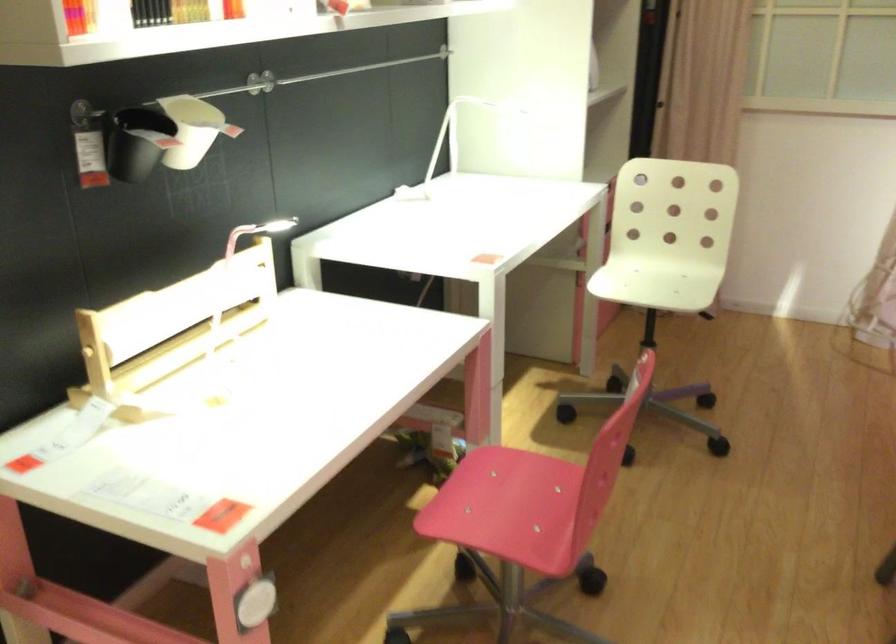
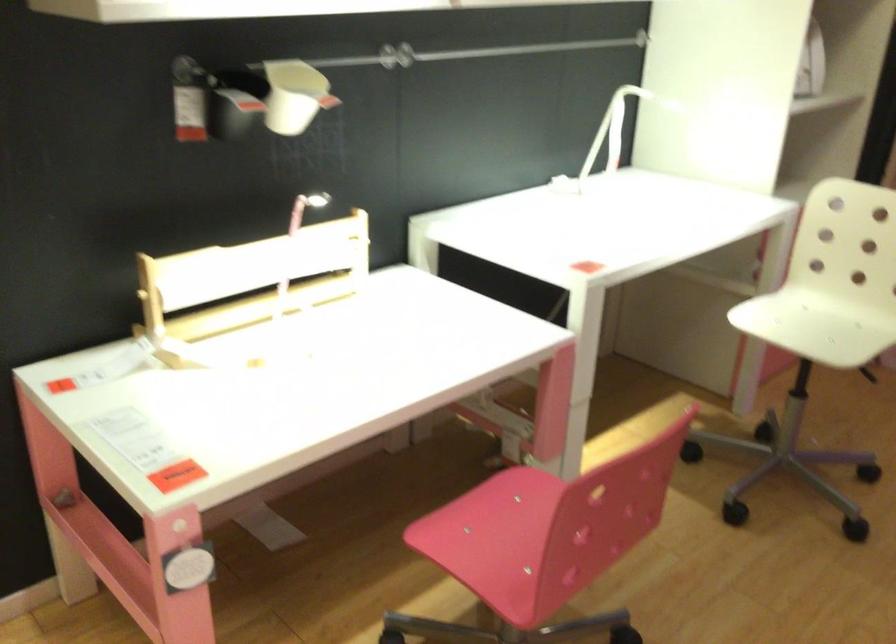
Locate, in the second image, the point that corresponds to (659,283) in the first image.

(812, 327)